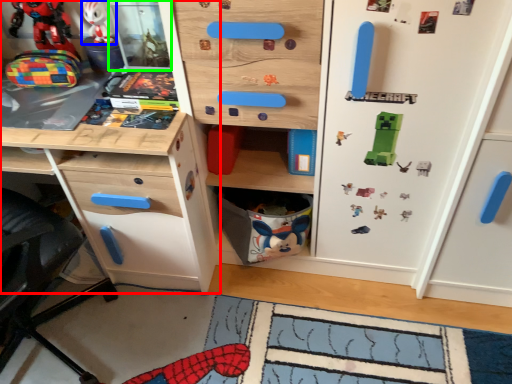
Question: Considering the real-world distances, which object is closest to chest of drawers (highlighted by a red box)? toy (highlighted by a blue box) or shelf (highlighted by a green box).

Choices:
 (A) toy
 (B) shelf

Answer: (B)